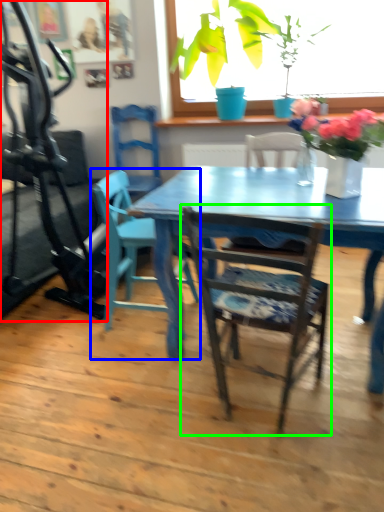
Question: Which object is positioned farthest from treadmill (highlighted by a red box)? Select from chair (highlighted by a blue box) and chair (highlighted by a green box).

Choices:
 (A) chair
 (B) chair

Answer: (B)